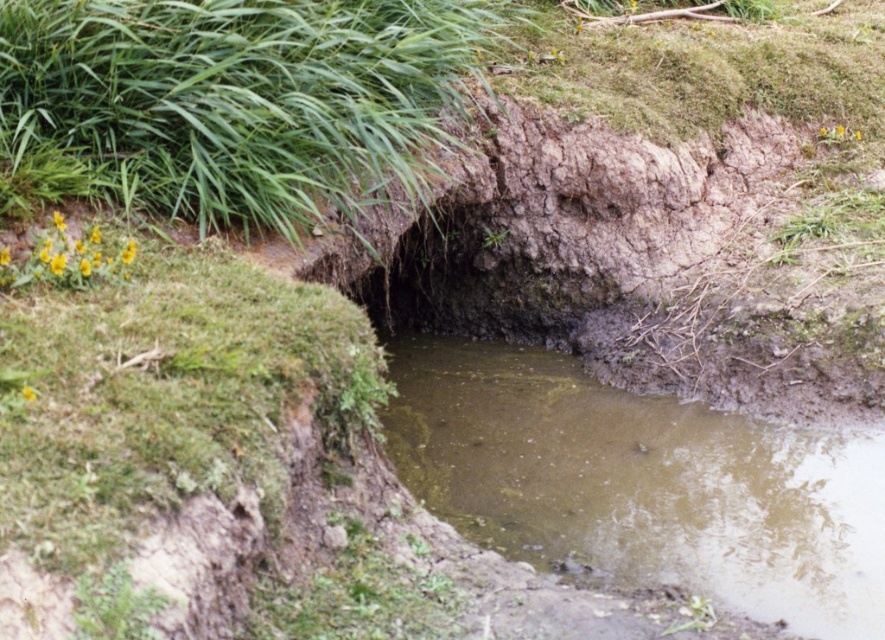
Who is higher up, brown muddy stream at center or green grass at upper left?

green grass at upper left is above.

Based on the photo, does brown muddy stream at center come behind green grass at upper left?

No, it is not.

Describe the element at coordinates (641, 483) in the screenshot. I see `brown muddy stream at center` at that location.

I want to click on brown muddy stream at center, so click(641, 483).